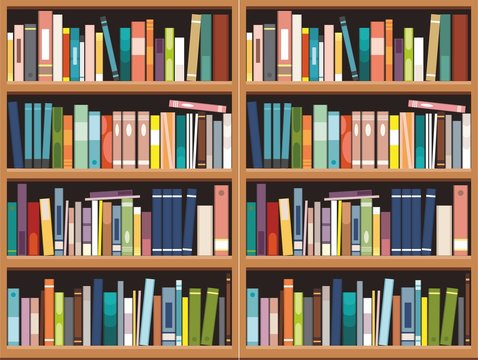
The width and height of the screenshot is (478, 360). I want to click on shelf, so click(x=172, y=86), click(x=180, y=180), click(x=187, y=254), click(x=192, y=347), click(x=315, y=84), click(x=354, y=178), click(x=378, y=258), click(x=393, y=349).